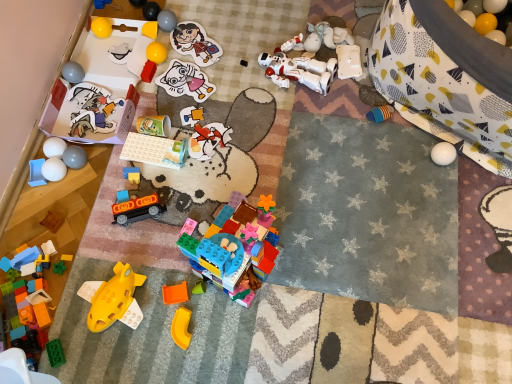
The height and width of the screenshot is (384, 512). I want to click on vacant area located to the right-hand side of yellow rubber ball at upper left, the fifteenth toy viewed from the left, so click(203, 62).